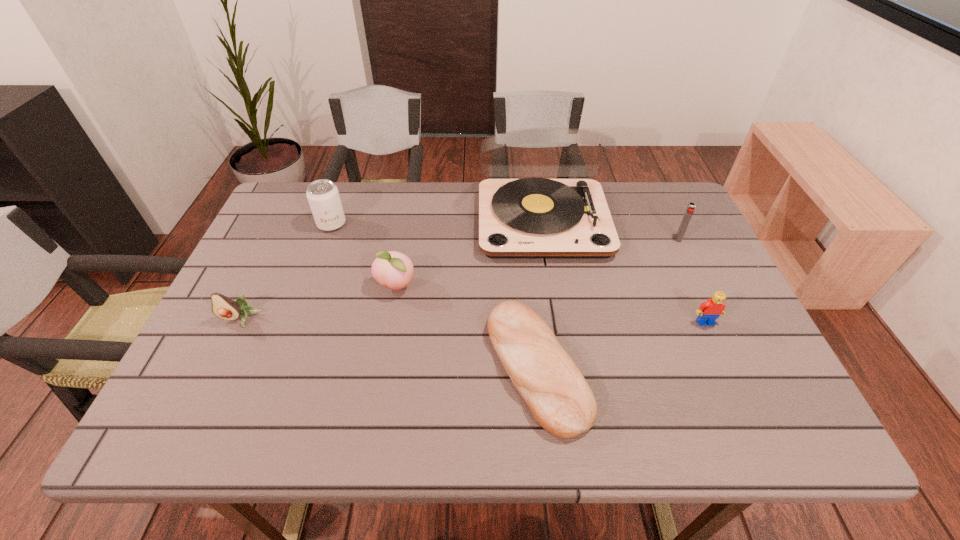
Identify the location of blank area in the image that satisfies the following two spatial constraints: 1. on the front side of the igniter; 2. on the right side of the soda can. (326, 239).

I want to click on vacant space that satisfies the following two spatial constraints: 1. on the seed side of the shortest object; 2. on the left side of the avocado, so click(217, 367).

The image size is (960, 540). I want to click on vacant region that satisfies the following two spatial constraints: 1. on the seed side of the shortest object; 2. on the left side of the leftmost object, so click(217, 367).